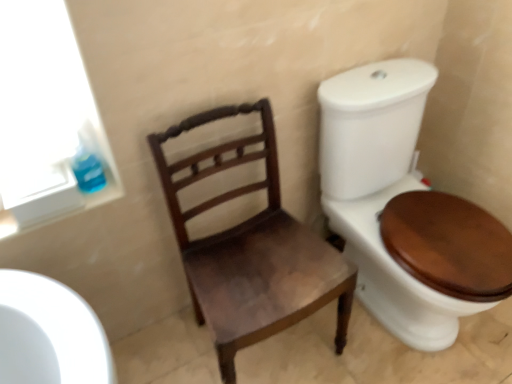
Question: Which is correct: mahogany wood chair at center is inside blue glossy toilet paper at upper left, or outside of it?

Choices:
 (A) outside
 (B) inside

Answer: (A)

Question: From a real-world perspective, is mahogany wood chair at center physically located above or below blue glossy toilet paper at upper left?

Choices:
 (A) below
 (B) above

Answer: (A)

Question: Relative to blue glossy toilet paper at upper left, is mahogany wood chair at center in front or behind?

Choices:
 (A) behind
 (B) front

Answer: (B)

Question: Is blue glossy toilet paper at upper left wider or thinner than mahogany wood chair at center?

Choices:
 (A) wide
 (B) thin

Answer: (B)

Question: From the image's perspective, relative to mahogany wood chair at center, is blue glossy toilet paper at upper left above or below?

Choices:
 (A) below
 (B) above

Answer: (B)

Question: Considering the positions of blue glossy toilet paper at upper left and mahogany wood chair at center in the image, is blue glossy toilet paper at upper left taller or shorter than mahogany wood chair at center?

Choices:
 (A) short
 (B) tall

Answer: (A)

Question: Would you say blue glossy toilet paper at upper left is to the left or to the right of mahogany wood chair at center in the picture?

Choices:
 (A) right
 (B) left

Answer: (B)